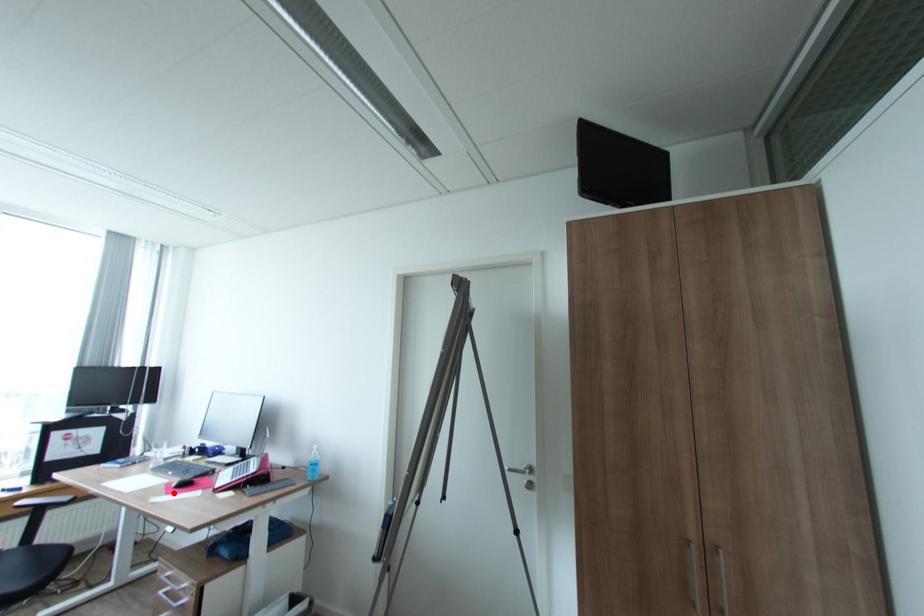
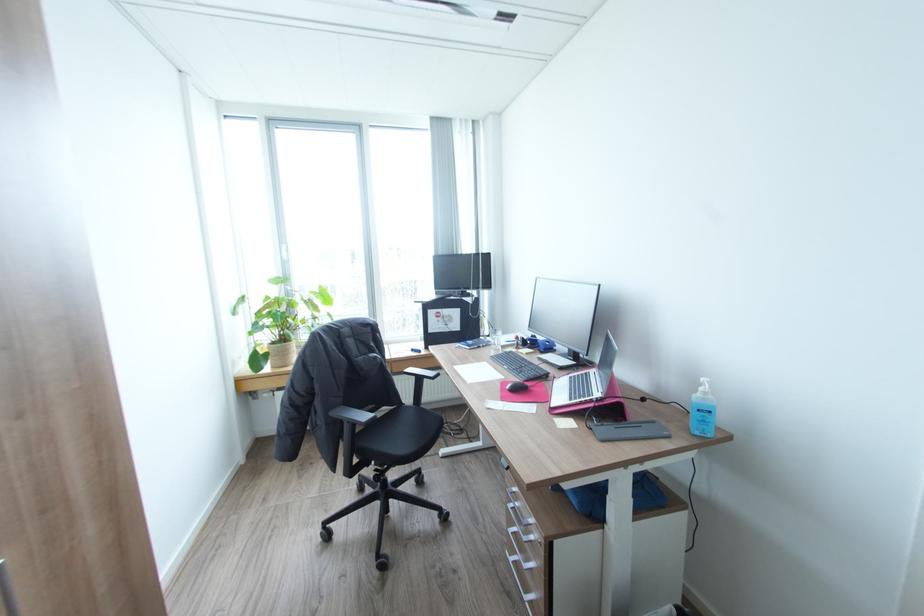
Where in the second image is the point corresponding to the highlighted location from the first image?

(507, 399)